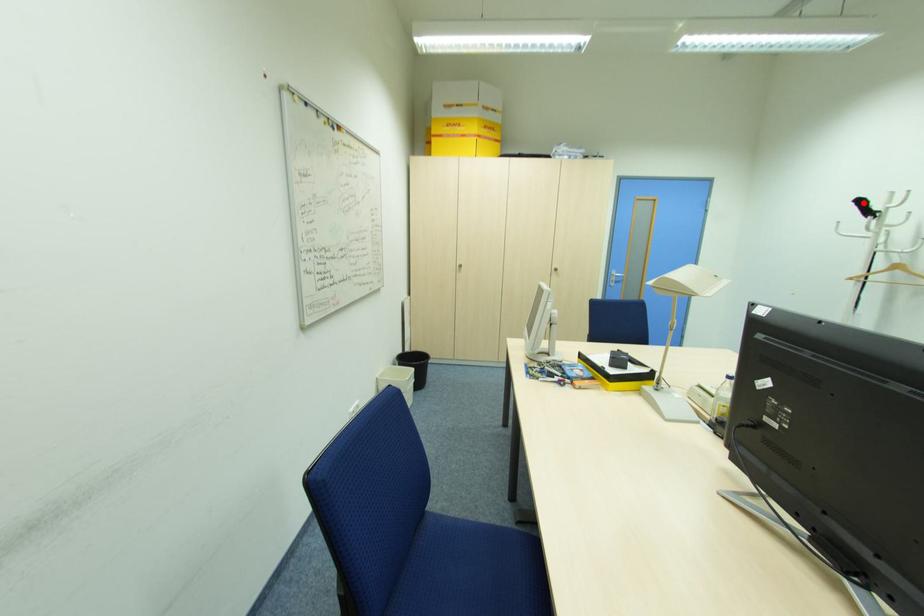
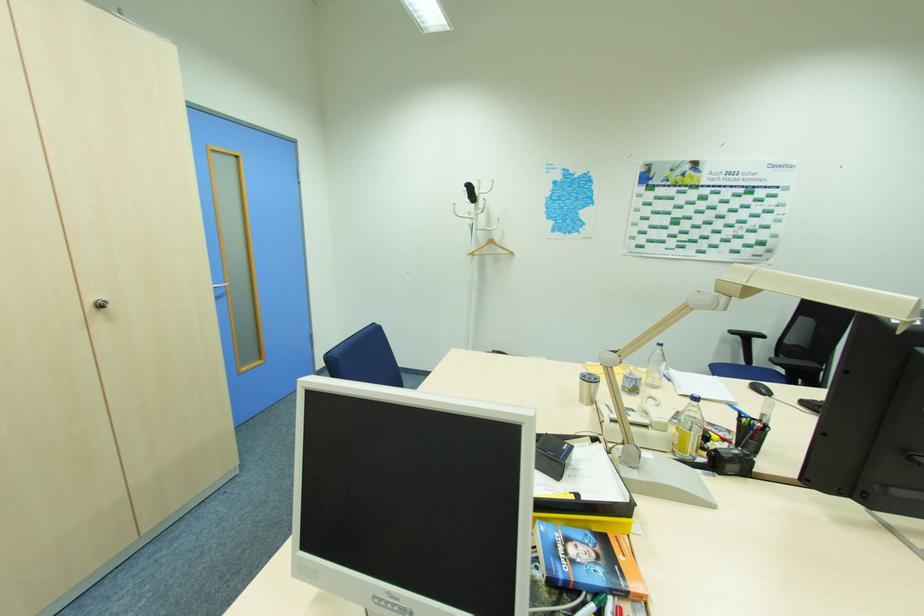
Question: A red point is marked in image1. In image2, is the corresponding 3D point closer to the camera or farther? Reply with the corresponding letter.

Choices:
 (A) The corresponding 3D point is closer.
 (B) The corresponding 3D point is farther.

Answer: (A)